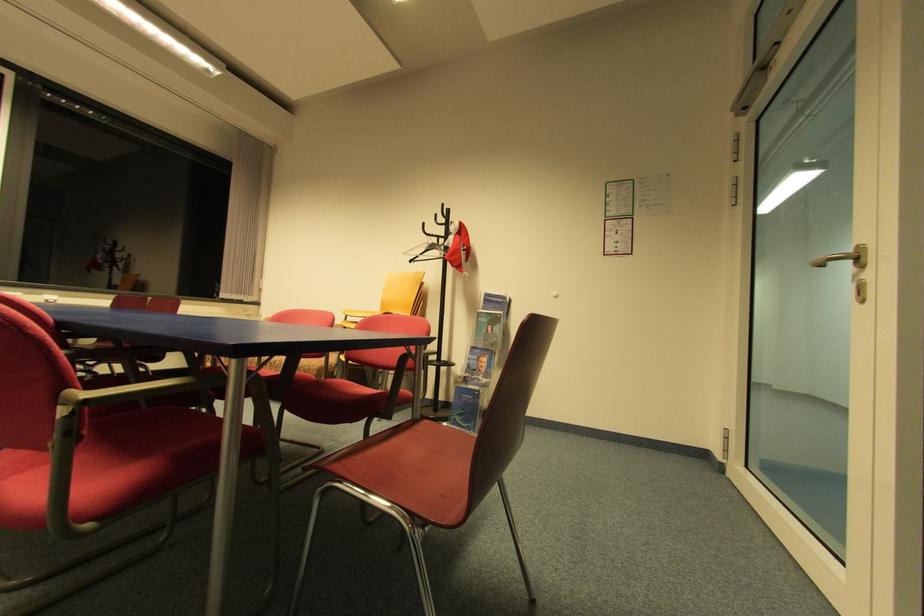
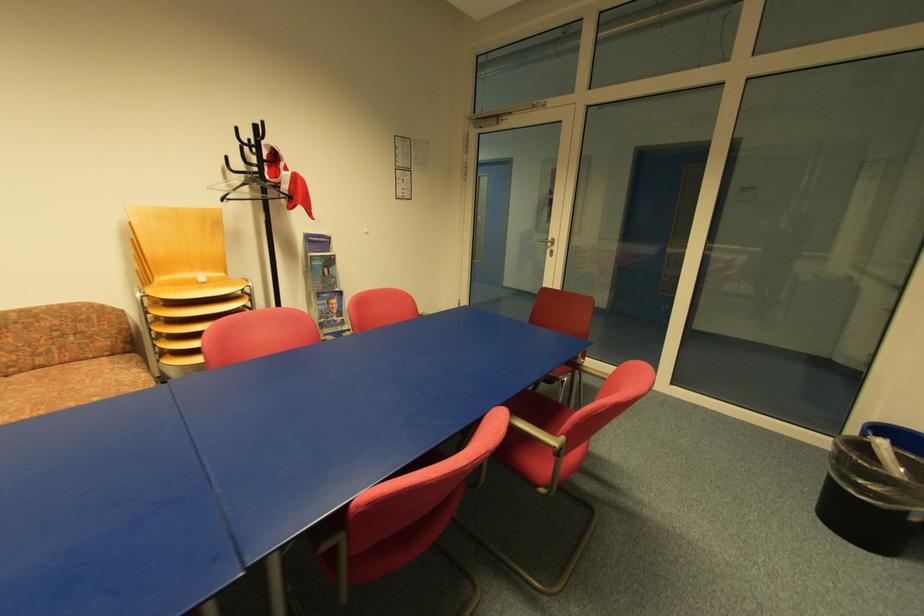
Find the pixel in the second image that matches pixel 494 333 in the first image.

(331, 275)